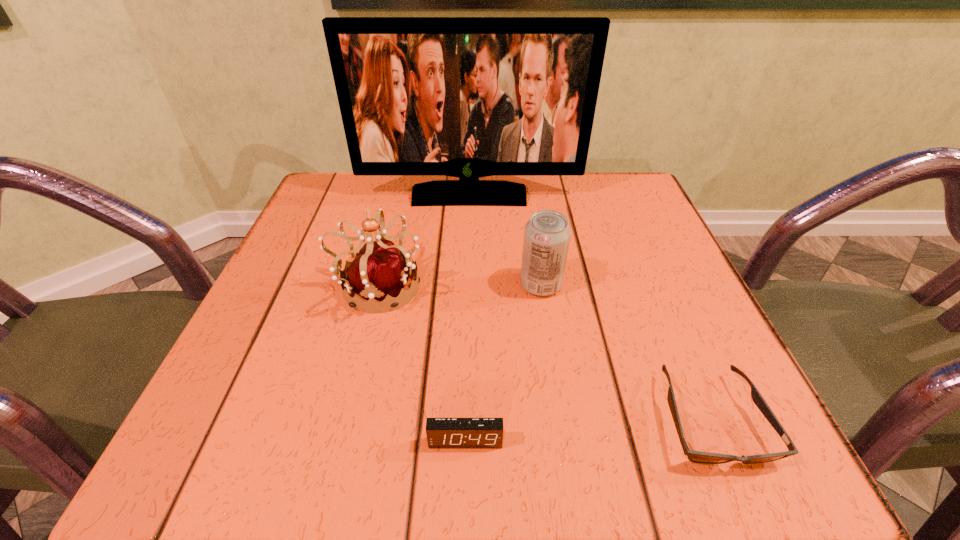
In the image, there is a desktop. Identify the location of free region at the far edge. (445, 219).

Where is `free space at the near edge`? This screenshot has width=960, height=540. free space at the near edge is located at coordinates [x=339, y=458].

Find the location of a particular element. Image resolution: width=960 pixels, height=540 pixels. blank space at the left edge of the desktop is located at coordinates (x=265, y=396).

Identify the location of vacant space at the right edge. Image resolution: width=960 pixels, height=540 pixels. (668, 323).

This screenshot has width=960, height=540. What are the coordinates of `vacant space at the far left corner of the desktop` in the screenshot? It's located at (331, 209).

Identify the location of vacant region at the near left corner. The width and height of the screenshot is (960, 540). (267, 472).

The width and height of the screenshot is (960, 540). What are the coordinates of `vacant region at the near right corner` in the screenshot? It's located at (749, 470).

This screenshot has width=960, height=540. I want to click on free area in between the tiara and the farthest object, so click(423, 241).

You are a GUI agent. You are given a task and a screenshot of the screen. Output one action in this format:
    pyautogui.click(x=<x>, y=<y>)
    Task: Click on the free point between the fourth shortest object and the shortest object
    
    Given the screenshot: What is the action you would take?
    pyautogui.click(x=544, y=353)

At what (x,y) coordinates should I click in order to perform the action: click on vacant space that's between the alarm clock and the sunglasses. Please return your answer as a coordinate pair (x, y). Image resolution: width=960 pixels, height=540 pixels. Looking at the image, I should click on (588, 430).